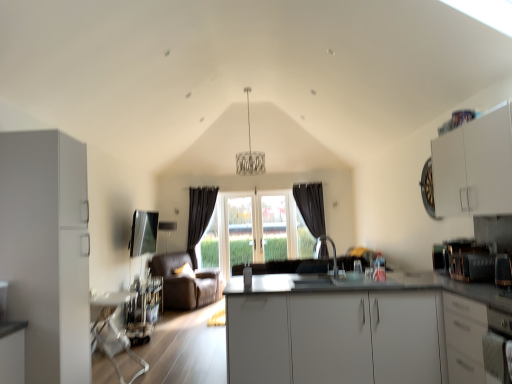
Question: Is satin silver oven at lower right turned away from white matte cabinet at left, acting as the 3th cabinetry starting from the right?

Choices:
 (A) yes
 (B) no

Answer: (B)

Question: From the image's perspective, would you say satin silver oven at lower right is positioned over white matte cabinet at left, the 1th cabinetry from the left?

Choices:
 (A) yes
 (B) no

Answer: (B)

Question: From the image's perspective, is satin silver oven at lower right beneath white matte cabinet at left, the 1th cabinetry from the left?

Choices:
 (A) yes
 (B) no

Answer: (A)

Question: Is satin silver oven at lower right positioned before white matte cabinet at left, the 1th cabinetry from the left?

Choices:
 (A) no
 (B) yes

Answer: (B)

Question: Considering the relative sizes of satin silver oven at lower right and white matte cabinet at left, acting as the 3th cabinetry starting from the right, in the image provided, is satin silver oven at lower right shorter than white matte cabinet at left, acting as the 3th cabinetry starting from the right,?

Choices:
 (A) yes
 (B) no

Answer: (A)

Question: From a real-world perspective, is satin silver oven at lower right physically below white matte cabinet at left, the 1th cabinetry from the left?

Choices:
 (A) no
 (B) yes

Answer: (B)

Question: From the image's perspective, is white matte cabinet at left, the 1th cabinetry from the left, above satin nickel faucet at center?

Choices:
 (A) yes
 (B) no

Answer: (A)

Question: Does white matte cabinet at left, the 1th cabinetry from the left, have a lesser width compared to satin nickel faucet at center?

Choices:
 (A) yes
 (B) no

Answer: (B)

Question: Is white matte cabinet at left, acting as the 3th cabinetry starting from the right, bigger than satin nickel faucet at center?

Choices:
 (A) no
 (B) yes

Answer: (B)

Question: From the image's perspective, is white matte cabinet at left, the 1th cabinetry from the left, located beneath satin nickel faucet at center?

Choices:
 (A) no
 (B) yes

Answer: (A)

Question: Is white matte cabinet at left, acting as the 3th cabinetry starting from the right, to the left of satin nickel faucet at center from the viewer's perspective?

Choices:
 (A) yes
 (B) no

Answer: (A)

Question: Considering the relative sizes of white matte cabinet at left, acting as the 3th cabinetry starting from the right, and satin nickel faucet at center in the image provided, is white matte cabinet at left, acting as the 3th cabinetry starting from the right, shorter than satin nickel faucet at center?

Choices:
 (A) no
 (B) yes

Answer: (A)

Question: Is white glossy cabinet at right, the 2th cabinetry when ordered from right to left, to the left of white glossy countertop at center from the viewer's perspective?

Choices:
 (A) yes
 (B) no

Answer: (B)